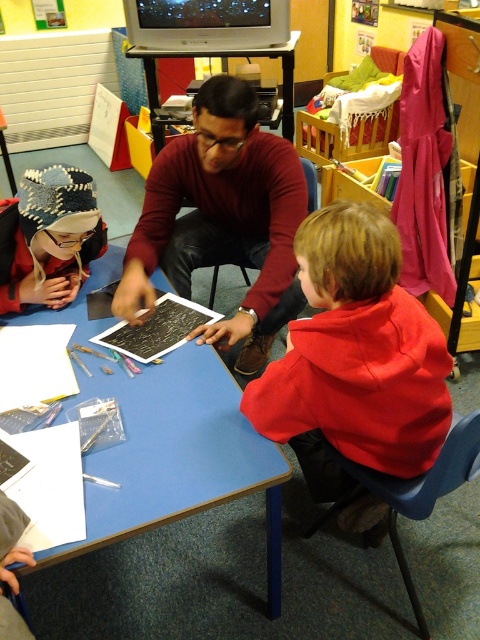
You are standing at the center of the classroom and want to pick up the red fleece jacket at lower right. Based on the coordinates provided, in which direction should you move to reach it?

The red fleece jacket at lower right is located at point 0.561 on the x and 0.740 on the y. Since you are at the center, you should move towards the lower right direction to reach it.

You are a student in the classroom and need to choose a seat. The maroon sweater at center and the knitted wool hat at upper left are already seated. Which seat is closer to the front of the classroom?

The knitted wool hat at upper left is closer to the front of the classroom because it is positioned at the upper left, while the maroon sweater at center is at the center, which is further back.